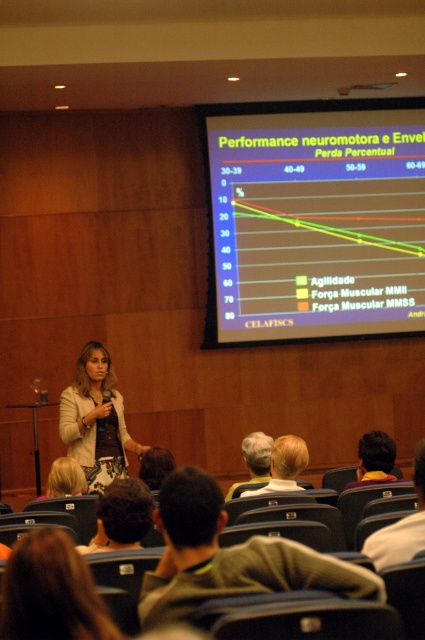
Can you confirm if matte beige blazer at center is thinner than yellow shirt at lower right?

No.

This screenshot has width=425, height=640. Describe the element at coordinates (95, 417) in the screenshot. I see `matte beige blazer at center` at that location.

Find the location of a particular element. matte beige blazer at center is located at coordinates (95, 417).

Does matte beige blazer at center lie in front of dark brown hair at lower center?

That is False.

Which is in front, point (105, 445) or point (149, 512)?

Point (149, 512) is more forward.

You are a GUI agent. You are given a task and a screenshot of the screen. Output one action in this format:
    pyautogui.click(x=<x>, y=<y>)
    Task: Click on the matte beige blazer at center
    The height and width of the screenshot is (640, 425).
    Given the screenshot: What is the action you would take?
    pyautogui.click(x=95, y=417)

Is the position of yellow shirt at lower right more distant than that of light brown hair at center?

No, yellow shirt at lower right is in front of light brown hair at center.

Where is `yellow shirt at lower right`? This screenshot has height=640, width=425. yellow shirt at lower right is located at coordinates (402, 525).

Looking at this image, measure the distance between yellow shirt at lower right and camera.

yellow shirt at lower right and camera are 9.30 feet apart.

This screenshot has width=425, height=640. I want to click on yellow shirt at lower right, so click(402, 525).